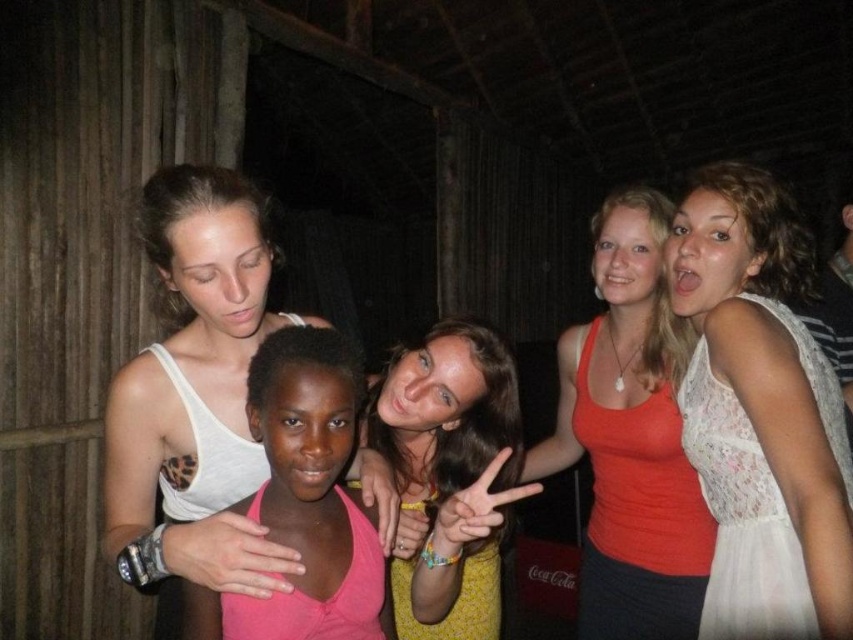
Question: Is white lace dress at center closer to camera compared to white tank top at upper left?

Choices:
 (A) yes
 (B) no

Answer: (B)

Question: Estimate the real-world distances between objects in this image. Which object is farther from the white lace dress at center?

Choices:
 (A) pink matte tank top at center
 (B) matte orange tank top at center
 (C) white tank top at upper left

Answer: (C)

Question: Does white lace dress at center appear on the left side of matte orange tank top at center?

Choices:
 (A) yes
 (B) no

Answer: (B)

Question: Is white lace dress at center closer to camera compared to matte orange tank top at center?

Choices:
 (A) yes
 (B) no

Answer: (A)

Question: Which point is closer to the camera?

Choices:
 (A) (187, 625)
 (B) (822, 586)
 (C) (422, 372)
 (D) (141, 193)

Answer: (B)

Question: Which of these objects is positioned farthest from the white lace dress at center?

Choices:
 (A) white tank top at upper left
 (B) yellowmaterialshirt at center

Answer: (A)